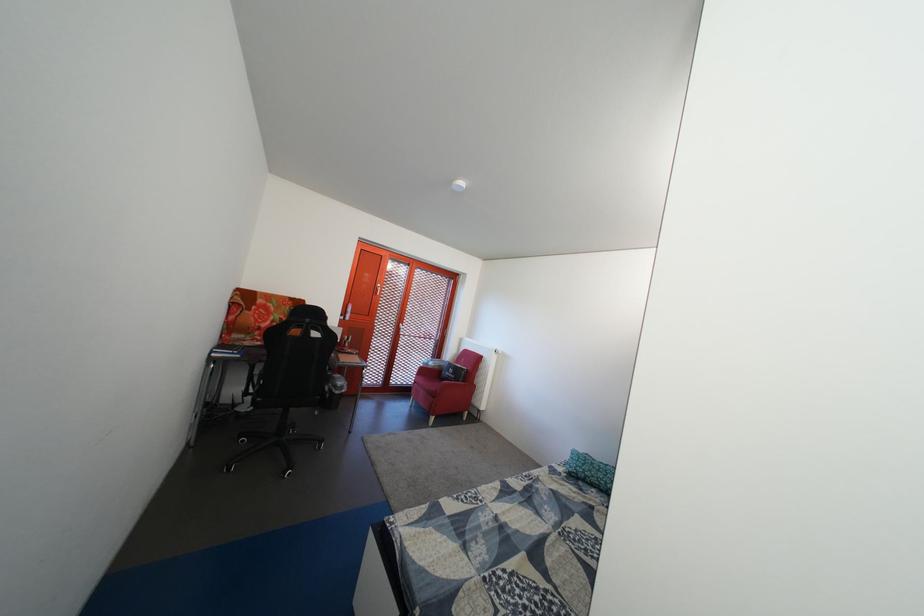
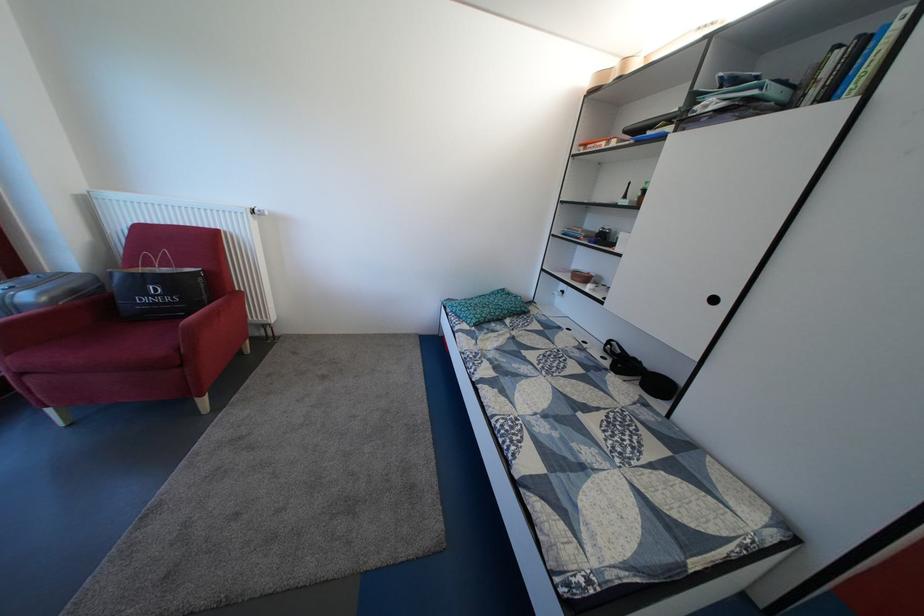
Locate, in the second image, the point that corresponds to (610,477) in the first image.

(494, 314)